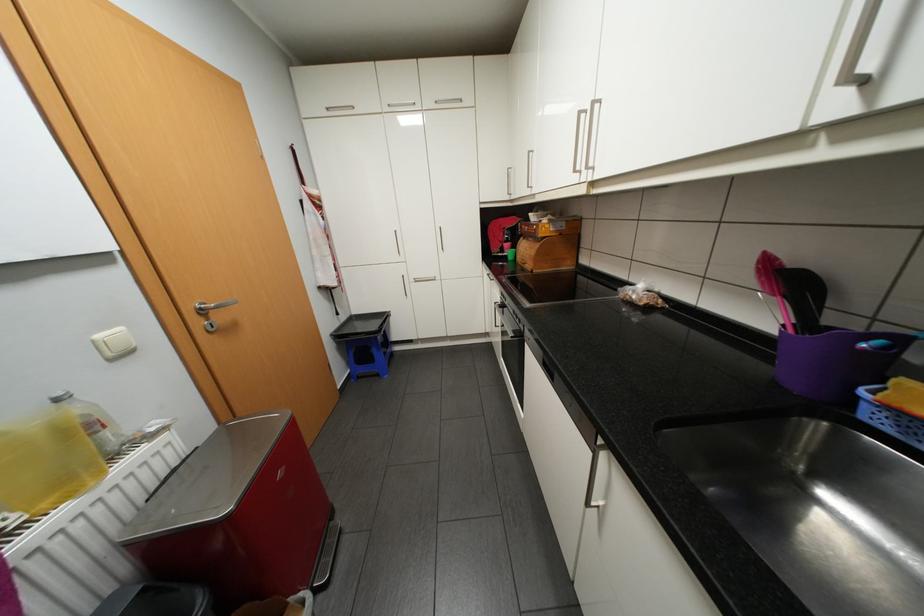
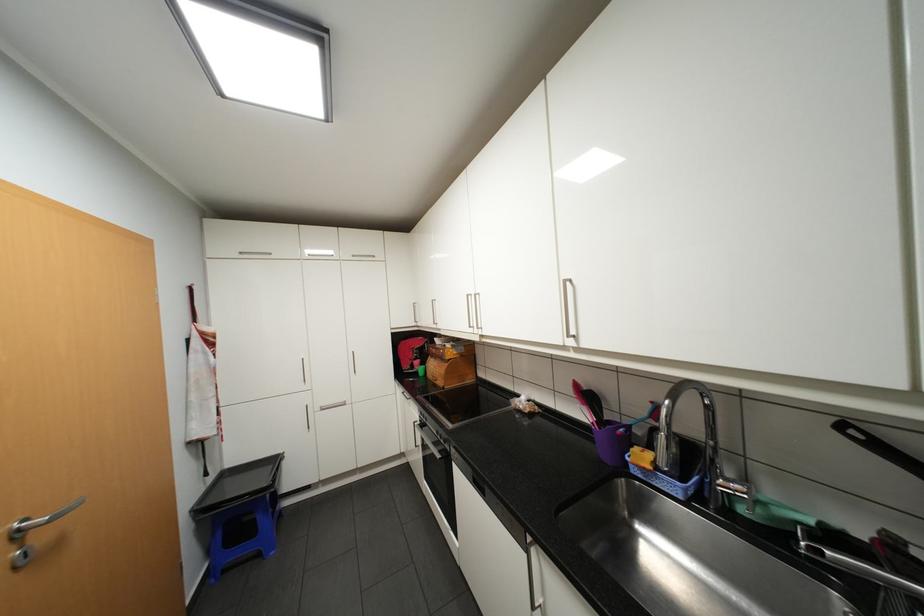
The point at (528, 192) is marked in the first image. Where is the corresponding point in the second image?

(434, 323)